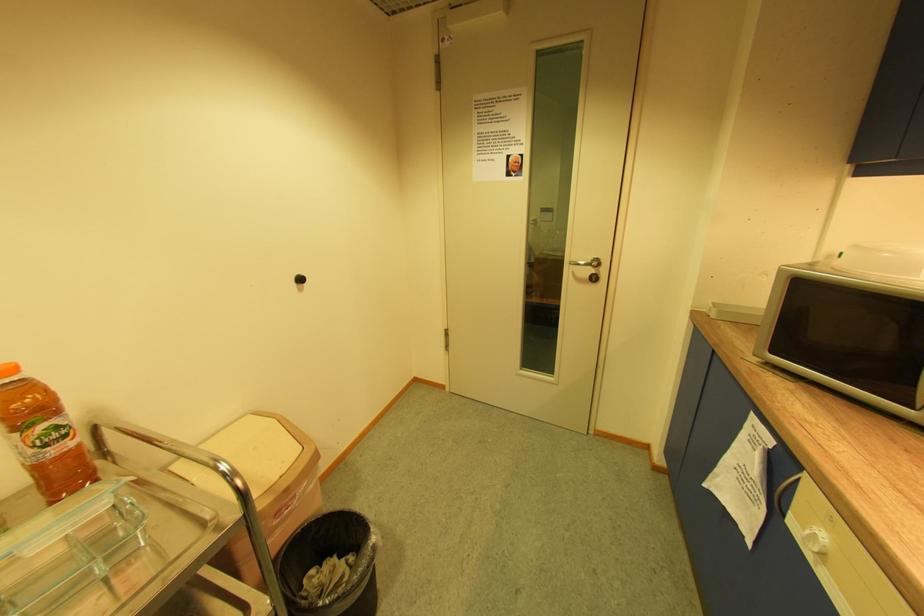
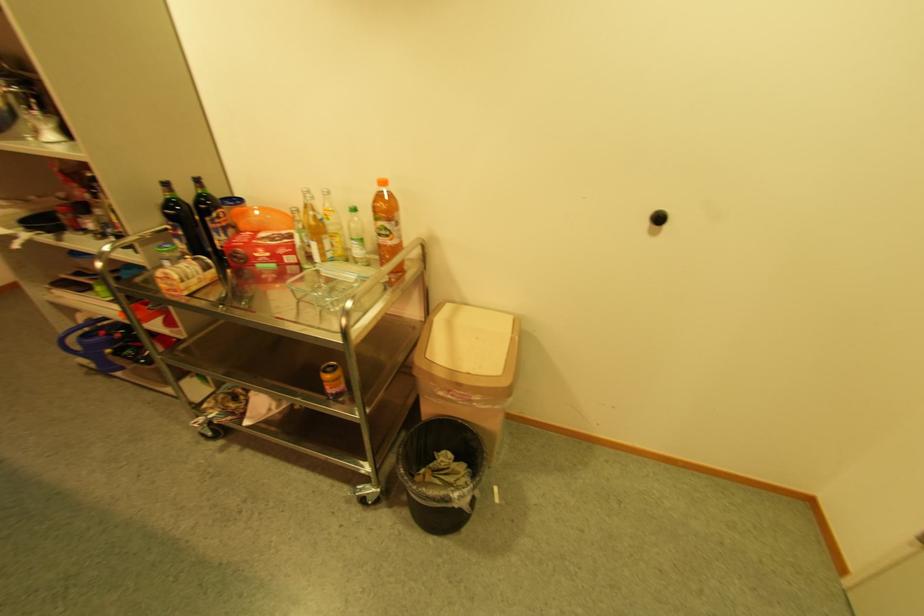
Where in the second image is the point corresponding to point (61, 437) from the first image?

(391, 233)